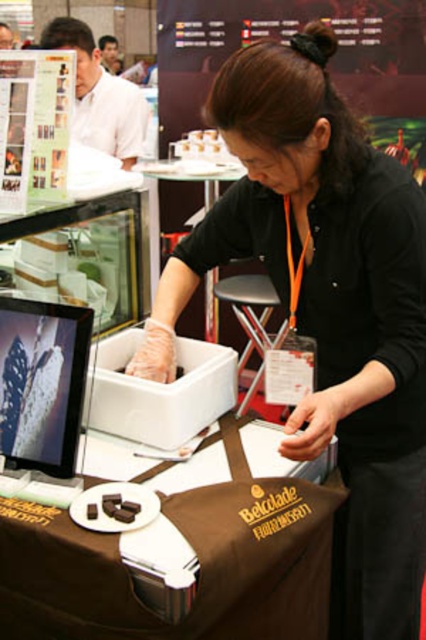
Between black matte shirt at center and metallic silver stool at center, which one appears on the left side from the viewer's perspective?

metallic silver stool at center is more to the left.

Can you confirm if black matte shirt at center is wider than metallic silver stool at center?

Indeed, black matte shirt at center has a greater width compared to metallic silver stool at center.

Which is behind, point (379, 616) or point (267, 282)?

Point (267, 282)

The image size is (426, 640). In order to click on black matte shirt at center in this screenshot , I will do `click(328, 307)`.

Based on the photo, does white plastic container at center have a lesser width compared to matte white shirt at upper left?

Yes, white plastic container at center is thinner than matte white shirt at upper left.

Is white plastic container at center wider than matte white shirt at upper left?

No, white plastic container at center is not wider than matte white shirt at upper left.

Where is `white plastic container at center`? The height and width of the screenshot is (640, 426). white plastic container at center is located at coordinates (190, 278).

Does black matte shirt at center have a larger size compared to white plastic container at center?

Correct, black matte shirt at center is larger in size than white plastic container at center.

Between point (310, 321) and point (212, 269), which one is positioned in front?

Point (310, 321) is more forward.

Is point (416, 440) less distant than point (154, 323)?

That is True.

Locate an element on the screen. The width and height of the screenshot is (426, 640). black matte shirt at center is located at coordinates coord(328,307).